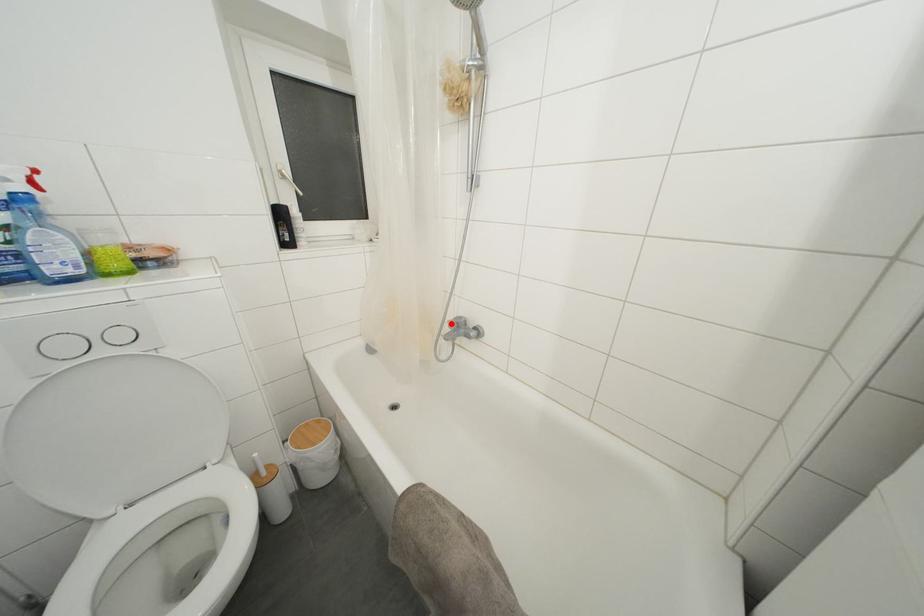
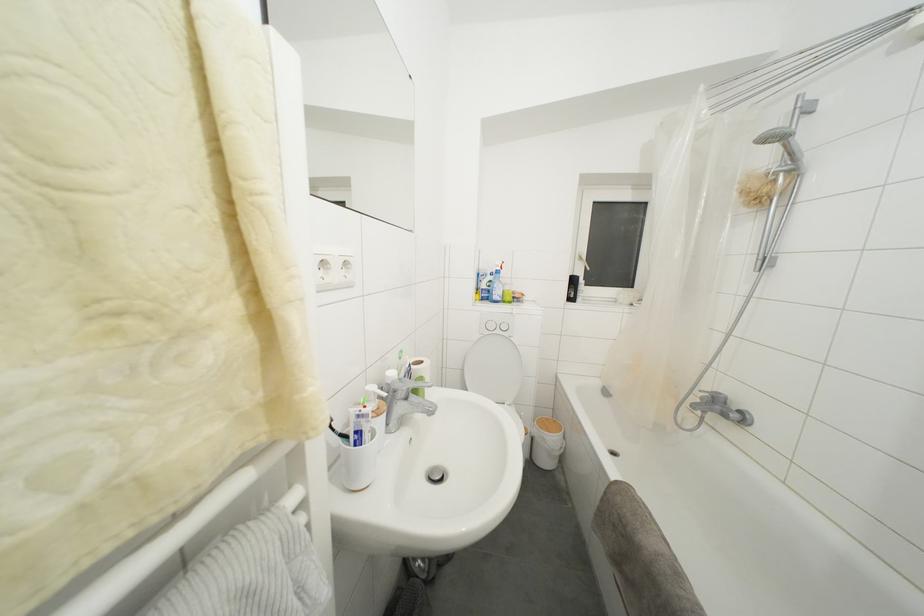
The point at the highlighted location is marked in the first image. Where is the corresponding point in the second image?

(703, 392)